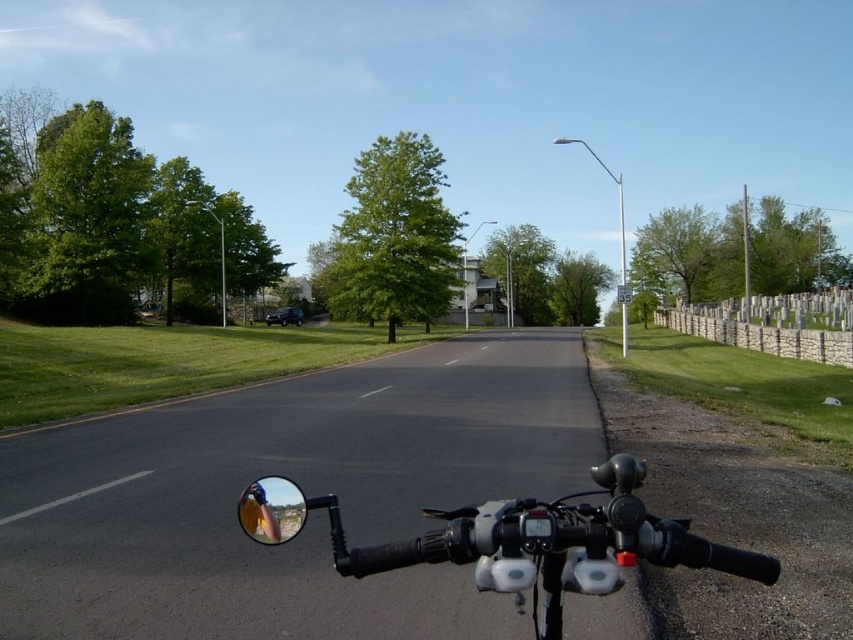
You are riding a motorcycle and want to check your surroundings using the shiny chrome mirror at lower left and the shiny chrome mirror at center. Which mirror would give you a wider field of view?

The shiny chrome mirror at lower left has a wider width than the shiny chrome mirror at center, so it would provide a wider field of view.

You are a motorcycle rider and you want to check your blind spot using the shiny chrome mirror at lower left and the shiny chrome mirror at center. Can you see the entire road behind you through both mirrors?

The distance between the shiny chrome mirror at lower left and shiny chrome mirror at center is 6.56 centimeters, but this measurement does not indicate whether the mirrors are positioned to cover the entire blind spot area. Mirrors placement and angle are crucial for full visibility, so you might need to adjust them properly to ensure you can see the entire road behind you.

You are riding a motorcycle and need to check your side mirror to avoid an oncoming vehicle. Which object, the black matte motorcycle handlebars at center or the shiny chrome mirror at lower left, do you need to look past to see the mirror properly?

Answer: You need to look past the black matte motorcycle handlebars at center because it is taller than the shiny chrome mirror at lower left, so you would need to position your head above or around the handlebars to see the mirror clearly.